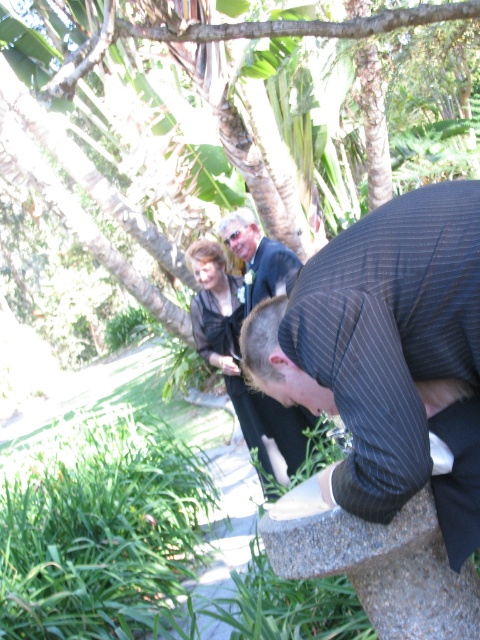
Question: Considering the real-world distances, which object is closest to the green leafy tree at upper center?

Choices:
 (A) dark gray fabric dress at center
 (B) dark pinstripe suit at center

Answer: (B)

Question: From the image, what is the correct spatial relationship of dark pinstripe suit at center in relation to green leafy tree at upper center?

Choices:
 (A) right
 (B) left

Answer: (A)

Question: Estimate the real-world distances between objects in this image. Which object is closer to the dark pinstripe suit at center?

Choices:
 (A) green leafy tree at upper center
 (B) dark gray fabric dress at center

Answer: (B)

Question: Which point is closer to the camera?

Choices:
 (A) dark pinstripe suit at center
 (B) dark gray fabric dress at center

Answer: (A)

Question: Can you confirm if green leafy tree at upper center is positioned above dark gray fabric dress at center?

Choices:
 (A) yes
 (B) no

Answer: (A)

Question: Is green leafy tree at upper center positioned behind dark gray fabric dress at center?

Choices:
 (A) no
 (B) yes

Answer: (A)